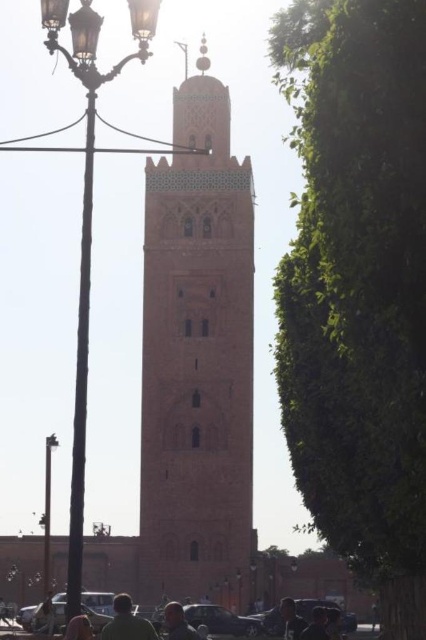
Question: Does green leafy tree at right appear on the right side of light brown hair at lower center?

Choices:
 (A) no
 (B) yes

Answer: (B)

Question: Is brass wrought iron streetlight at left above light brown hair at center?

Choices:
 (A) no
 (B) yes

Answer: (B)

Question: Is green leafy tree at right to the left of polished brass lamp post at center from the viewer's perspective?

Choices:
 (A) no
 (B) yes

Answer: (A)

Question: Estimate the real-world distances between objects in this image. Which object is farther from the green fabric shirt at lower center?

Choices:
 (A) polished brass lamp post at center
 (B) green leafy tree at right

Answer: (B)

Question: Which object appears farthest from the camera in this image?

Choices:
 (A) metallic streetlamp at left
 (B) light brown hair at lower center

Answer: (A)

Question: Which object appears farthest from the camera in this image?

Choices:
 (A) green fabric person at lower left
 (B) green fabric shirt at lower center
 (C) light brown hair at center
 (D) green leafy tree at right

Answer: (B)